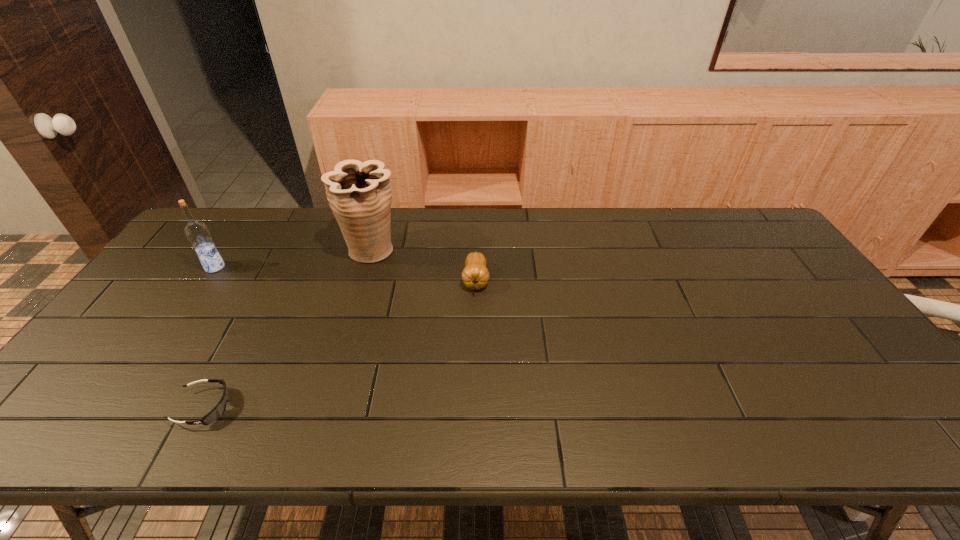
I want to click on the third object from left to right, so click(x=359, y=194).

This screenshot has width=960, height=540. Find the location of `the leftmost object`. the leftmost object is located at coordinates (197, 232).

In order to click on the rightmost object in this screenshot , I will do `click(475, 275)`.

Find the location of a particular element. This screenshot has width=960, height=540. the second shortest object is located at coordinates (475, 275).

This screenshot has width=960, height=540. Identify the location of goggles. (219, 409).

Locate an element on the screen. This screenshot has height=540, width=960. the second object from left to right is located at coordinates (219, 409).

This screenshot has height=540, width=960. I want to click on free location located 0.140m on the front of the second object from right to left, so click(x=356, y=301).

This screenshot has height=540, width=960. Find the location of `vacant space located on the back of the leftmost object`. vacant space located on the back of the leftmost object is located at coordinates (228, 249).

Locate an element on the screen. The width and height of the screenshot is (960, 540). vacant region located on the stem side of the second shortest object is located at coordinates (475, 358).

This screenshot has width=960, height=540. Identify the location of free location located 0.310m on the front and sides of the goggles. (368, 407).